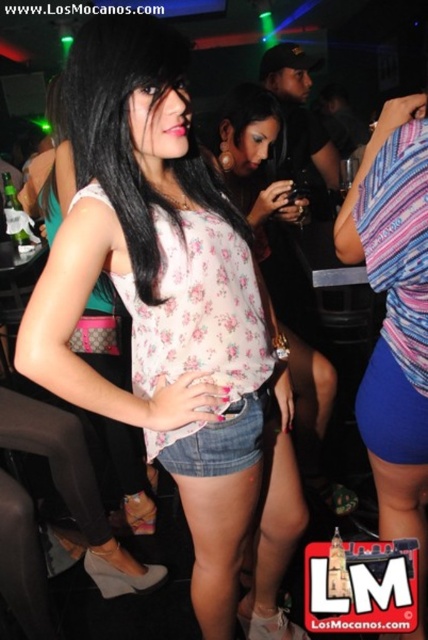
You are standing in the nightlife scene and want to move towards the two points marked in the image. Which point, point [186,376] or point [15,218], would you reach first?

You would reach point [186,376] first because it is closer to you than point [15,218].

In the nightlife scene, there are two items mentioned in the foreground of the image. They are the floral fabric top at center and the floral fabric blouse at center. Based on their positions, which one is located more to the right?

The floral fabric top at center is positioned to the right of the floral fabric blouse at center, so the floral fabric top at center is more to the right.